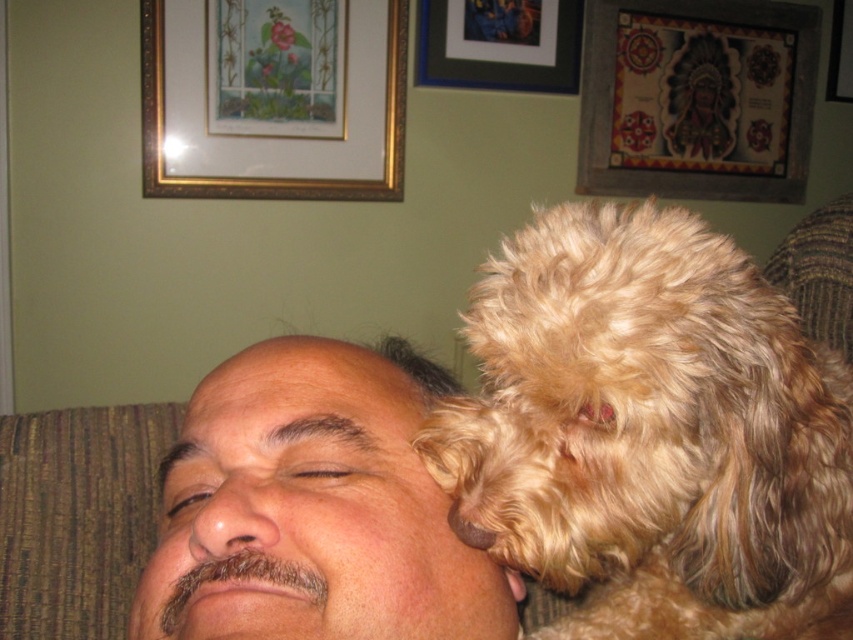
Looking at this image, who is taller, wooden framed artwork at upper right or matte black picture frame at upper center?

Standing taller between the two is wooden framed artwork at upper right.

Describe the element at coordinates (697, 99) in the screenshot. I see `wooden framed artwork at upper right` at that location.

I want to click on wooden framed artwork at upper right, so point(697,99).

The image size is (853, 640). In order to click on wooden framed artwork at upper right in this screenshot , I will do `click(697, 99)`.

Is fuzzy golden dog at upper right to the left of matte black picture frame at upper center from the viewer's perspective?

No, fuzzy golden dog at upper right is not to the left of matte black picture frame at upper center.

Which is more to the left, fuzzy golden dog at upper right or matte black picture frame at upper center?

From the viewer's perspective, matte black picture frame at upper center appears more on the left side.

Describe the element at coordinates (653, 433) in the screenshot. I see `fuzzy golden dog at upper right` at that location.

I want to click on fuzzy golden dog at upper right, so click(x=653, y=433).

Does fuzzy golden dog at upper right have a greater width compared to gold-framed picture at upper left?

No.

Identify the location of fuzzy golden dog at upper right. (653, 433).